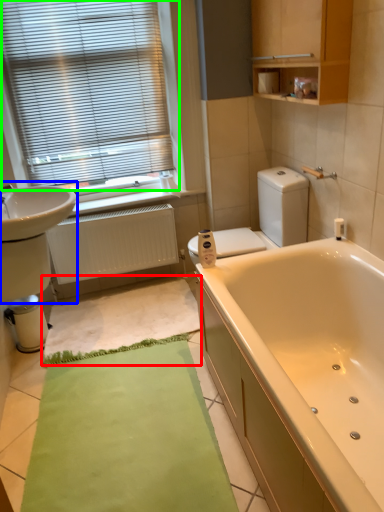
Question: Considering the real-world distances, which object is closest to bath mat (highlighted by a red box)? sink (highlighted by a blue box) or window blind (highlighted by a green box).

Choices:
 (A) sink
 (B) window blind

Answer: (A)